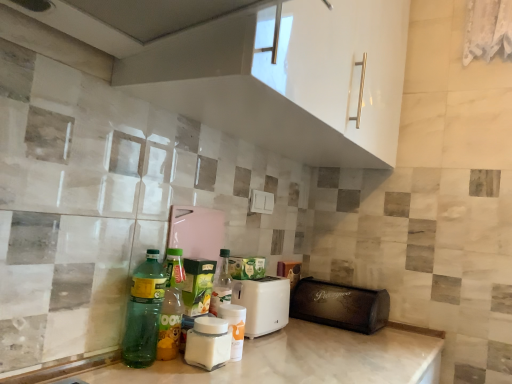
Question: From their relative heights in the image, would you say white glossy jar at center, the 2th bottle viewed from the right, is taller or shorter than green glass bottle at center, positioned as the 3th bottle in right-to-left order?

Choices:
 (A) tall
 (B) short

Answer: (B)

Question: From a real-world perspective, is white glossy jar at center, the third bottle when ordered from left to right, above or below green glass bottle at center, which is the 2th bottle from left to right?

Choices:
 (A) below
 (B) above

Answer: (A)

Question: Based on their relative distances, which object is nearer to the green translucent bottle at lower left, the 1th bottle when ordered from left to right?

Choices:
 (A) white plastic toaster at center, the second appliance viewed from the right
 (B) white glossy jar at center, marked as the first bottle in a right-to-left arrangement
 (C) green glass bottle at center, positioned as the 3th bottle in right-to-left order
 (D) black leather bread bin at lower right, placed as the 2th appliance when sorted from left to right
 (E) white glossy jar at center, the third bottle when ordered from left to right

Answer: (C)

Question: Considering the real-world distances, which object is closest to the white plastic toaster at center, the second appliance viewed from the right?

Choices:
 (A) green translucent bottle at lower left, the 1th bottle when ordered from left to right
 (B) white glossy jar at center, the third bottle when ordered from left to right
 (C) white glossy jar at center, placed as the fourth bottle when sorted from left to right
 (D) green glass bottle at center, which is the 2th bottle from left to right
 (E) black leather bread bin at lower right, the first appliance from the right

Answer: (C)